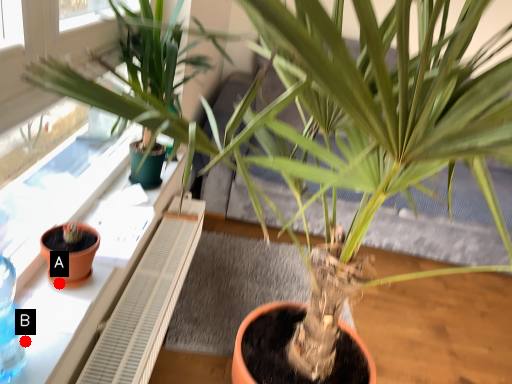
Question: Two points are circled on the image, labeled by A and B beside each circle. Which of the following is the farthest from the observer?

Choices:
 (A) A is further
 (B) B is further

Answer: (A)